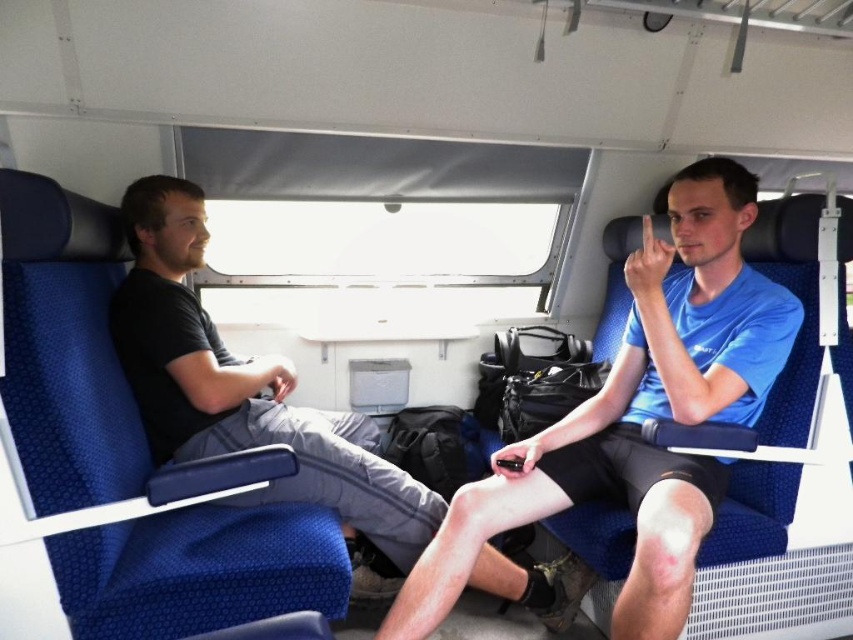
Which is more to the left, blue matte shirt at right or black cotton shirt at left?

black cotton shirt at left is more to the left.

Image resolution: width=853 pixels, height=640 pixels. Find the location of `blue matte shirt at right`. blue matte shirt at right is located at coordinates (637, 416).